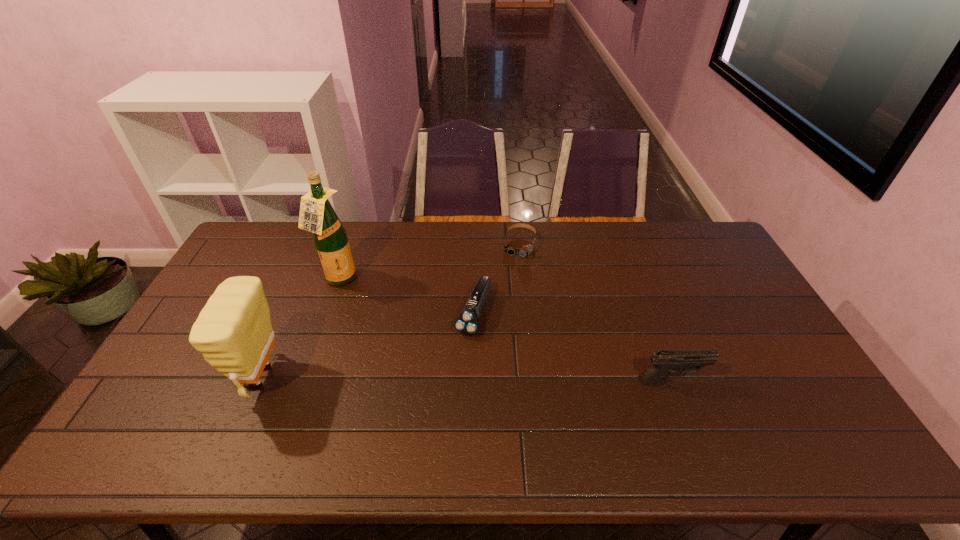
This screenshot has width=960, height=540. What are the coordinates of `the second tallest object` in the screenshot? It's located at (233, 331).

Locate an element on the screen. This screenshot has width=960, height=540. pistol is located at coordinates (664, 362).

In order to click on the third shortest object in this screenshot , I will do `click(664, 362)`.

This screenshot has height=540, width=960. I want to click on liquor, so click(317, 215).

The height and width of the screenshot is (540, 960). In order to click on the shortest object in this screenshot , I will do `click(525, 250)`.

The image size is (960, 540). In order to click on the farthest object in this screenshot , I will do `click(525, 250)`.

Image resolution: width=960 pixels, height=540 pixels. I want to click on the third object from left to right, so click(467, 323).

The width and height of the screenshot is (960, 540). Identify the location of the fourth tallest object. (467, 323).

This screenshot has height=540, width=960. I want to click on vacant space situated 0.180m on the face of the sponge, so click(173, 377).

Locate an element on the screen. This screenshot has width=960, height=540. vacant region located 0.080m on the face of the sponge is located at coordinates (209, 377).